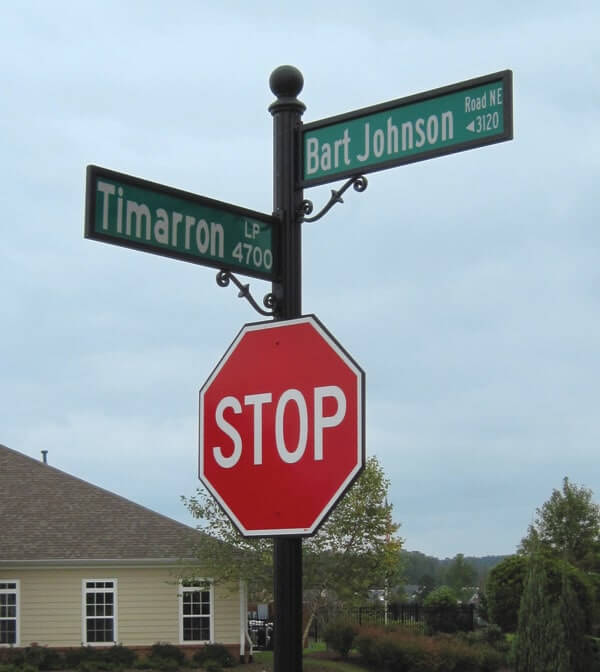
Find the location of a particular element. The height and width of the screenshot is (672, 600). vent pipe is located at coordinates (43, 453).